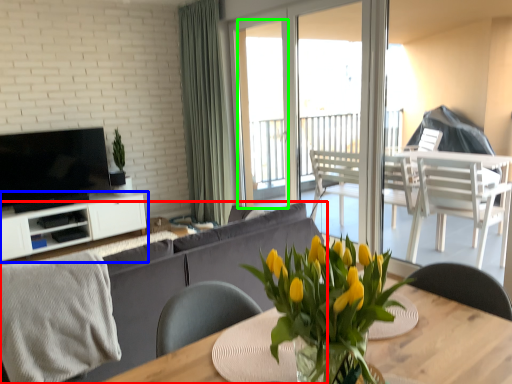
Question: Which is nearer to the studio couch (highlighted by a red box)? cabinetry (highlighted by a blue box) or window screen (highlighted by a green box).

Choices:
 (A) cabinetry
 (B) window screen

Answer: (A)